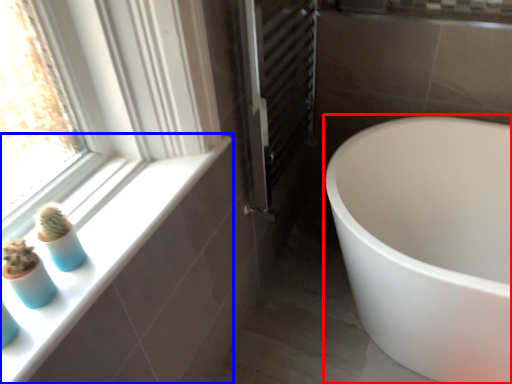
Question: Which point is further to the camera, bathtub (highlighted by a red box) or window sill (highlighted by a blue box)?

Choices:
 (A) bathtub
 (B) window sill

Answer: (A)